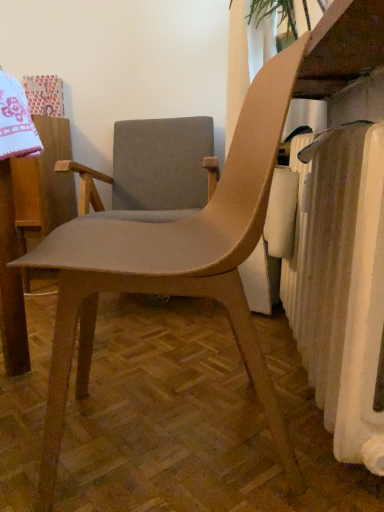
In order to face gray fabric chair at center, should I rotate leftwards or rightwards?

You should look left and rotate roughly 5.386 degrees.

Find the location of `gray fabric chair at center`. gray fabric chair at center is located at coordinates (153, 170).

What do you see at coordinates (153, 170) in the screenshot? I see `gray fabric chair at center` at bounding box center [153, 170].

Where is `gray fabric chair at center`? The height and width of the screenshot is (512, 384). gray fabric chair at center is located at coordinates (153, 170).